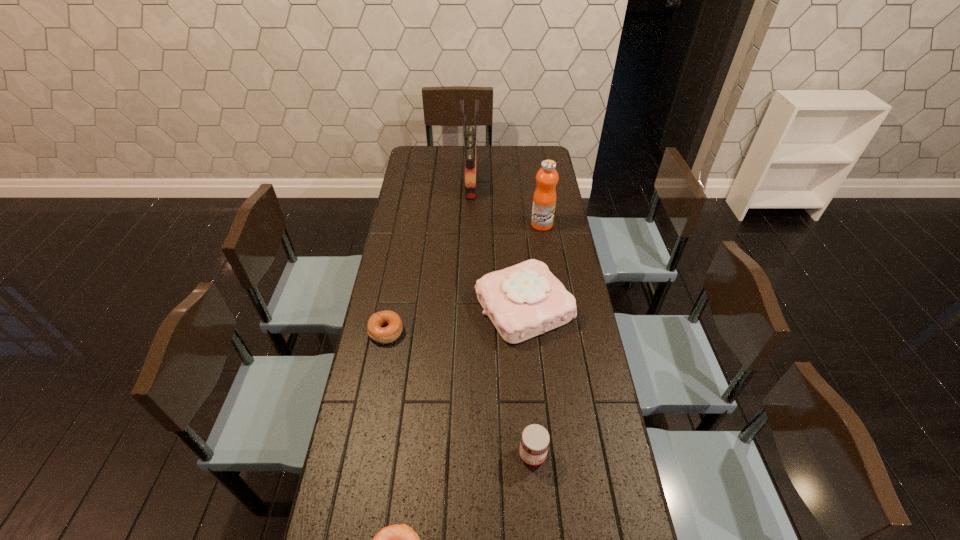
At what (x,y) coordinates should I click in order to perform the action: click on the farthest object. Please return your answer as a coordinate pair (x, y). Looking at the image, I should click on (469, 134).

Locate an element on the screen. The height and width of the screenshot is (540, 960). shopping bag is located at coordinates (469, 134).

Locate an element on the screen. The image size is (960, 540). the second tallest object is located at coordinates (544, 200).

Identify the location of fruit juice. Image resolution: width=960 pixels, height=540 pixels. (544, 200).

Locate an element on the screen. cake is located at coordinates (525, 300).

You are a GUI agent. You are given a task and a screenshot of the screen. Output one action in this format:
    pyautogui.click(x=<x>, y=<y>)
    Task: Click on the jam
    
    Given the screenshot: What is the action you would take?
    pyautogui.click(x=534, y=443)

Find the location of `the fifth farthest object`. the fifth farthest object is located at coordinates (534, 443).

Where is `the second shortest object`? the second shortest object is located at coordinates (392, 321).

You are a GUI agent. You are given a task and a screenshot of the screen. Output one action in this format:
    pyautogui.click(x=<x>, y=<y>)
    Task: Click on the farther bagel
    
    Given the screenshot: What is the action you would take?
    pyautogui.click(x=392, y=321)

Where is `vacant region located on the front-facing side of the shopping bag`? The image size is (960, 540). vacant region located on the front-facing side of the shopping bag is located at coordinates (500, 183).